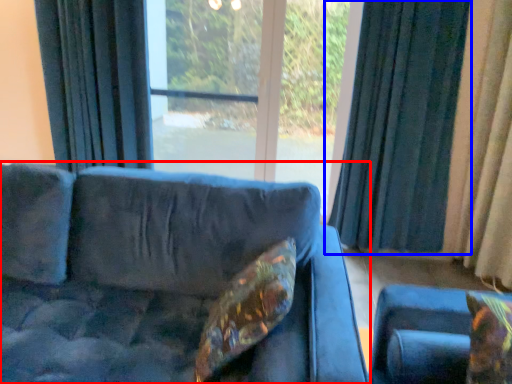
Question: Which object is closer to the camera taking this photo, studio couch (highlighted by a red box) or curtain (highlighted by a blue box)?

Choices:
 (A) studio couch
 (B) curtain

Answer: (A)